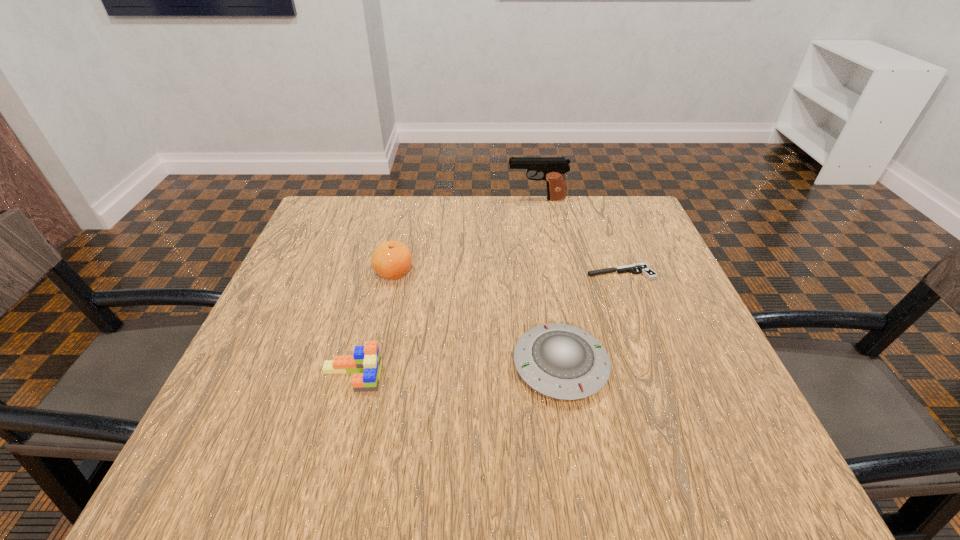
Locate an element on the screen. the left pistol is located at coordinates (553, 168).

Locate an element on the screen. The width and height of the screenshot is (960, 540). the taller pistol is located at coordinates (553, 168).

You are a GUI agent. You are given a task and a screenshot of the screen. Output one action in this format:
    pyautogui.click(x=<x>, y=<y>)
    Task: Click on the clementine
    The height and width of the screenshot is (540, 960).
    Given the screenshot: What is the action you would take?
    pyautogui.click(x=392, y=259)

This screenshot has width=960, height=540. I want to click on Lego, so click(x=366, y=363).

The width and height of the screenshot is (960, 540). What are the coordinates of `the second shortest object` in the screenshot? It's located at point(564,362).

Locate an element on the screen. The image size is (960, 540). the shortest object is located at coordinates (641, 268).

Identify the location of the nearer pistol. This screenshot has width=960, height=540. (641, 268).

This screenshot has width=960, height=540. I want to click on vacant space located at the barrel of the farthest object, so click(x=438, y=199).

Identify the location of vacant space located 0.170m at the barrel of the farthest object. Image resolution: width=960 pixels, height=540 pixels. (448, 199).

This screenshot has height=540, width=960. What are the coordinates of `free spot located at the barrel of the farthest object` in the screenshot? It's located at (444, 199).